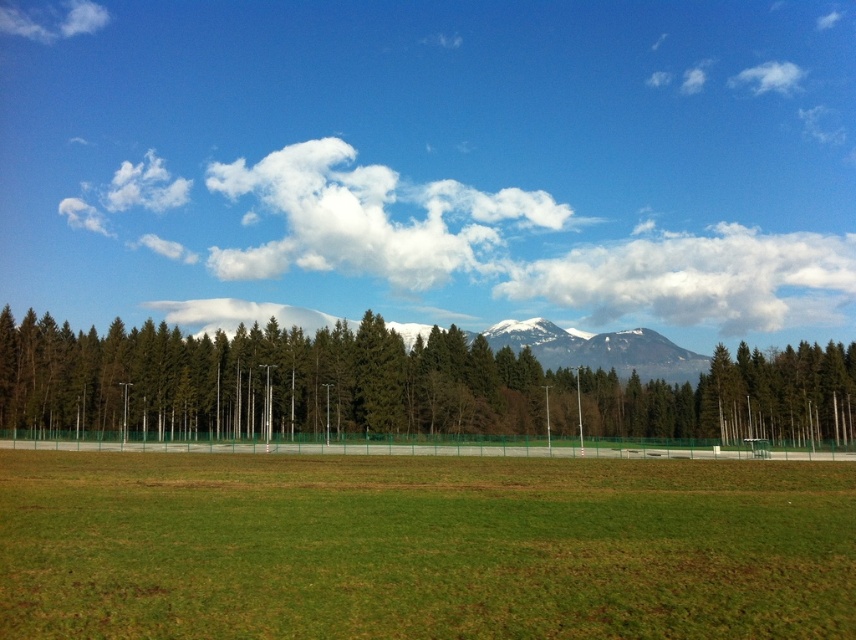
Question: Is green grass field at center to the right of white fluffy cloud at upper left from the viewer's perspective?

Choices:
 (A) yes
 (B) no

Answer: (A)

Question: Among these objects, which one is nearest to the camera?

Choices:
 (A) white fluffy cloud at upper left
 (B) white fluffy cloud at upper center
 (C) green grass field at center

Answer: (C)

Question: Observing the image, what is the correct spatial positioning of green grass field at center in reference to green textured trees at center?

Choices:
 (A) below
 (B) above

Answer: (B)

Question: From the image, what is the correct spatial relationship of green grass field at center in relation to green textured trees at center?

Choices:
 (A) right
 (B) left

Answer: (B)

Question: Estimate the real-world distances between objects in this image. Which object is closer to the white fluffy cloud at upper left?

Choices:
 (A) green textured trees at center
 (B) green grass field at center
 (C) white fluffy cloud at upper center

Answer: (C)

Question: Which of the following is the farthest from the observer?

Choices:
 (A) (825, 248)
 (B) (730, 593)
 (C) (515, 356)

Answer: (A)